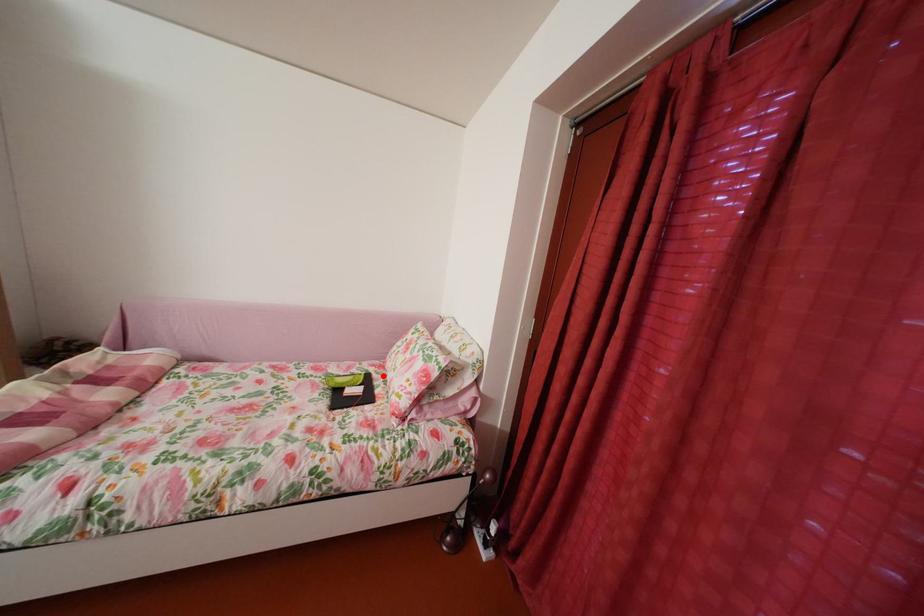
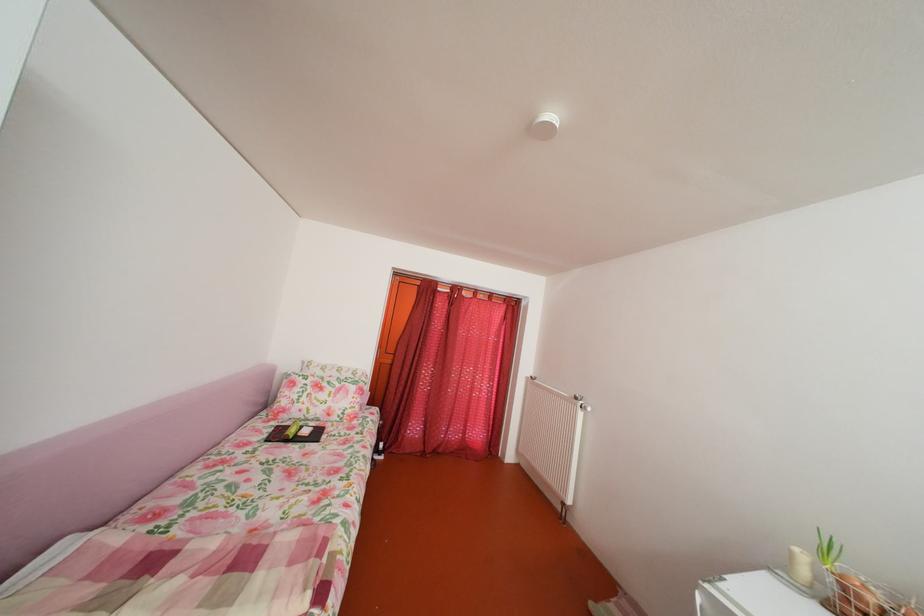
Question: I am providing you with two images of the same scene from different viewpoints. A red point is marked on the first image. Can you still see the location of the red point in image 2?

Choices:
 (A) Yes
 (B) No

Answer: (A)